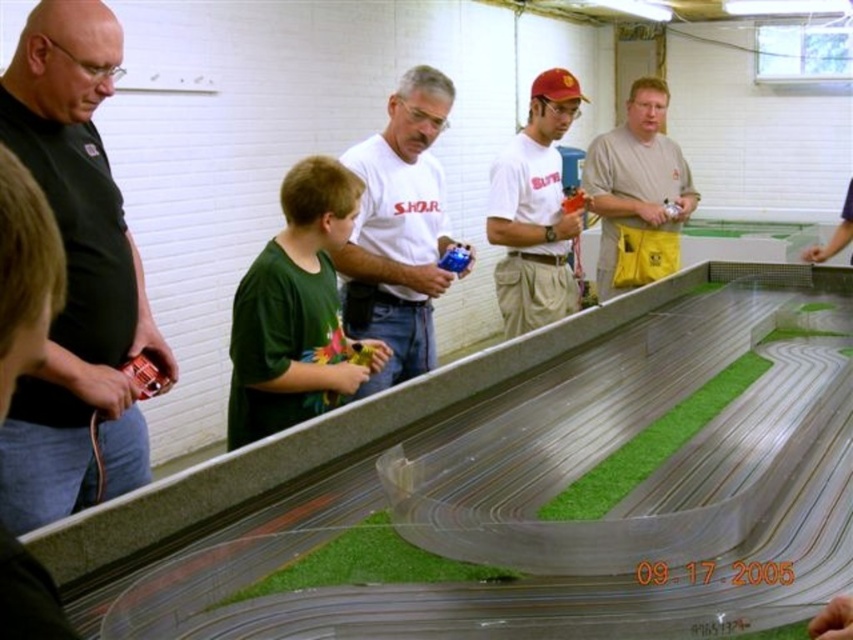
Does matte white t-shirt at center appear under blue plastic toy at center?

Actually, matte white t-shirt at center is above blue plastic toy at center.

Can you confirm if matte white t-shirt at center is thinner than blue plastic toy at center?

No.

Is point (578, 298) farther from camera compared to point (468, 250)?

Yes, it is.

Locate an element on the screen. matte white t-shirt at center is located at coordinates (534, 211).

Which is in front, point (428, 80) or point (444, 256)?

Point (428, 80)

Is white matte shirt at center to the right of blue plastic toy at center from the viewer's perspective?

Incorrect, white matte shirt at center is not on the right side of blue plastic toy at center.

Is point (427, 257) closer to viewer compared to point (456, 257)?

That is False.

Find the location of a particular element. white matte shirt at center is located at coordinates (398, 230).

Is white matte shirt at center smaller than matte white t-shirt at center?

No.

Is white matte shirt at center to the right of matte white t-shirt at center from the viewer's perspective?

In fact, white matte shirt at center is to the left of matte white t-shirt at center.

Which is in front, point (415, 371) or point (514, 273)?

Point (415, 371)

Image resolution: width=853 pixels, height=640 pixels. Identify the location of white matte shirt at center. (398, 230).